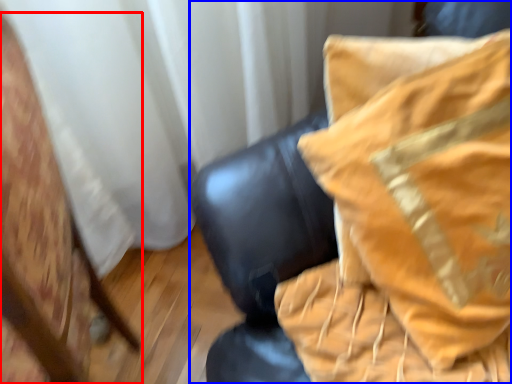
Question: Which object is closer to the camera taking this photo, furniture (highlighted by a red box) or furniture (highlighted by a blue box)?

Choices:
 (A) furniture
 (B) furniture

Answer: (A)